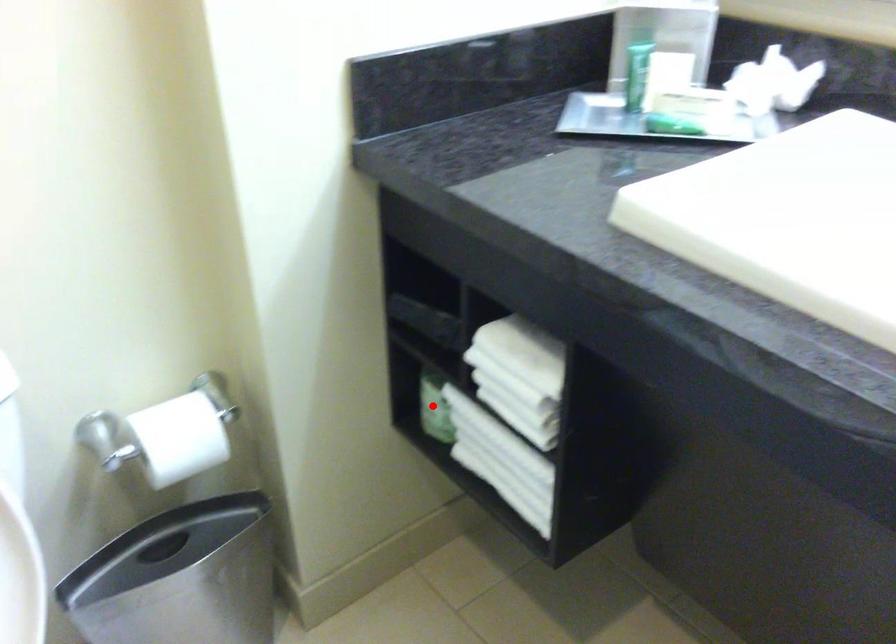
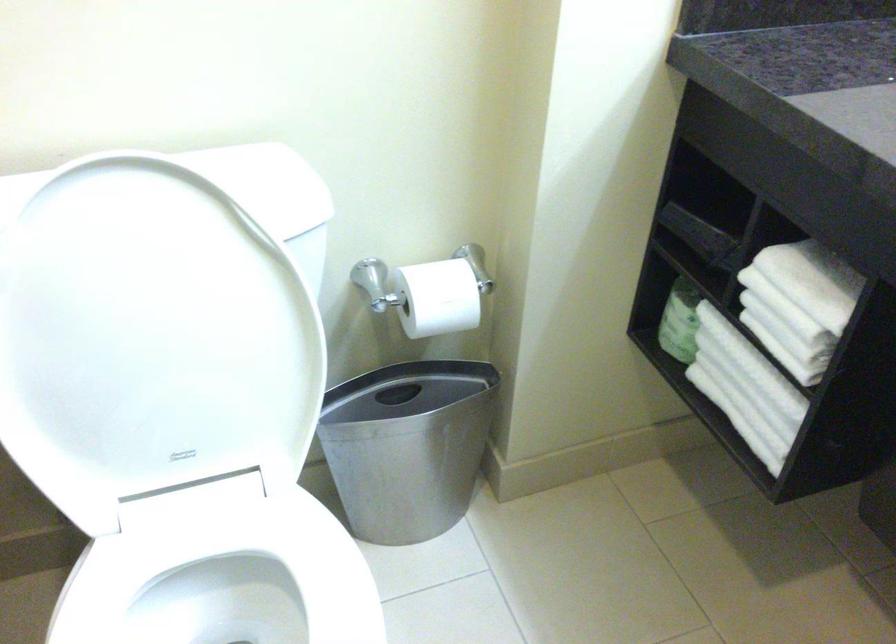
In the second image, find the point that corresponds to the highlighted location in the first image.

(679, 321)